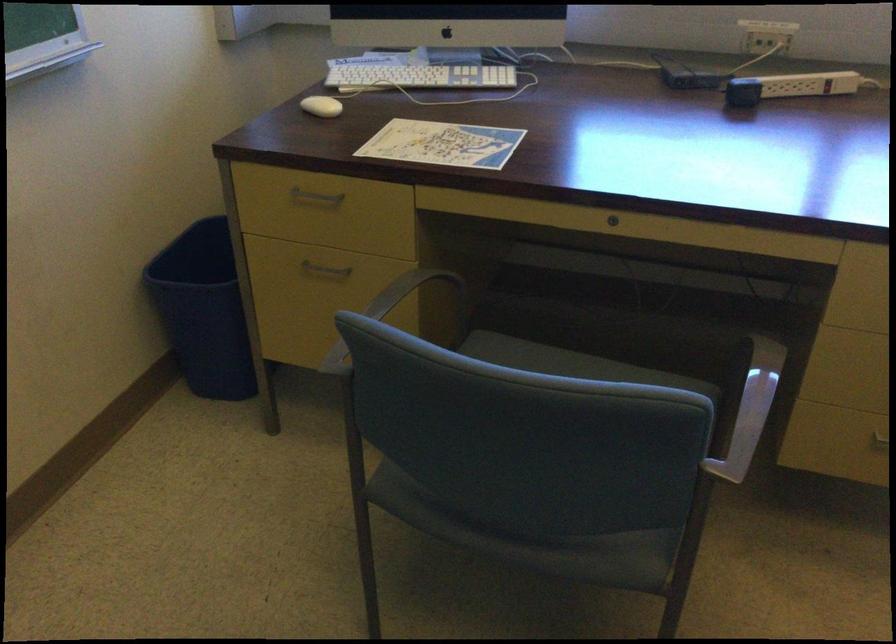
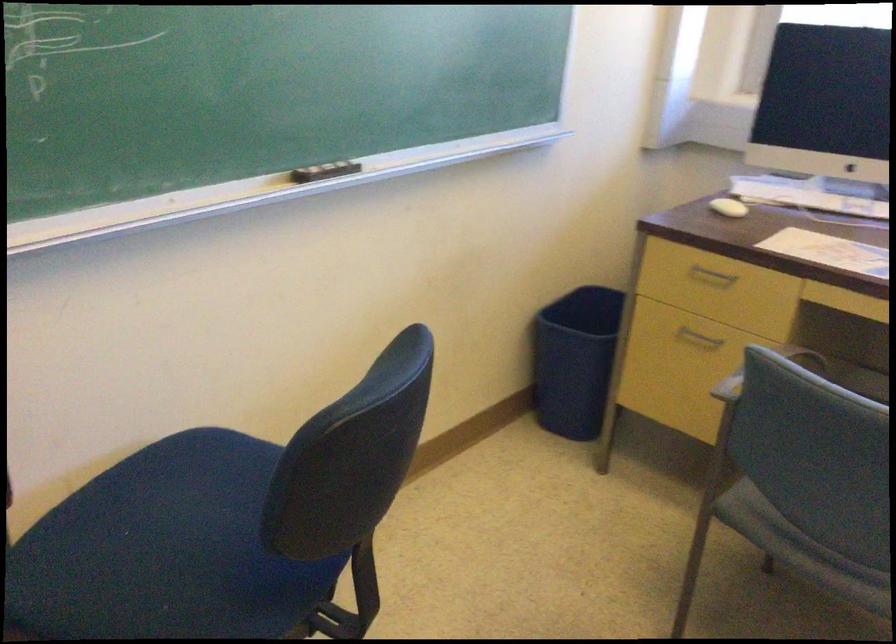
The point at (359, 346) is marked in the first image. Where is the corresponding point in the second image?

(764, 371)